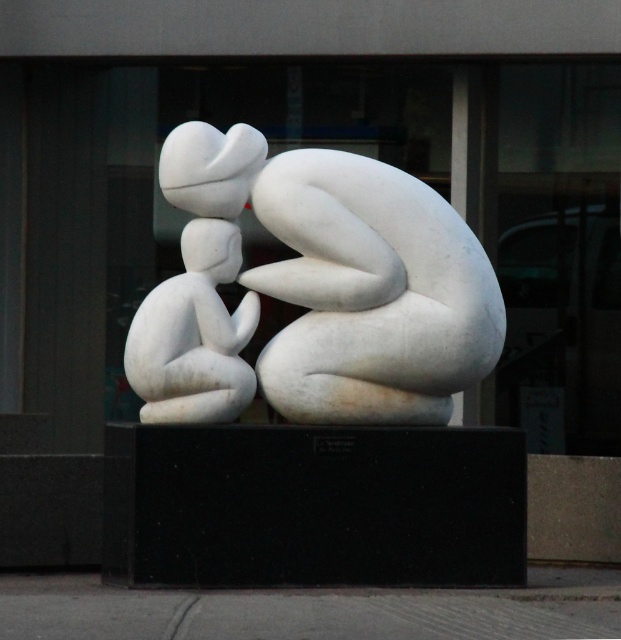
Question: Considering the relative positions of white marble sculpture at center and white matte stone child at left in the image provided, where is white marble sculpture at center located with respect to white matte stone child at left?

Choices:
 (A) left
 (B) right

Answer: (B)

Question: Is white marble sculpture at center thinner than white matte stone child at left?

Choices:
 (A) no
 (B) yes

Answer: (A)

Question: Does white marble sculpture at center appear over white matte stone child at left?

Choices:
 (A) no
 (B) yes

Answer: (B)

Question: Which object appears closest to the camera in this image?

Choices:
 (A) white marble sculpture at center
 (B) white matte stone child at left

Answer: (A)